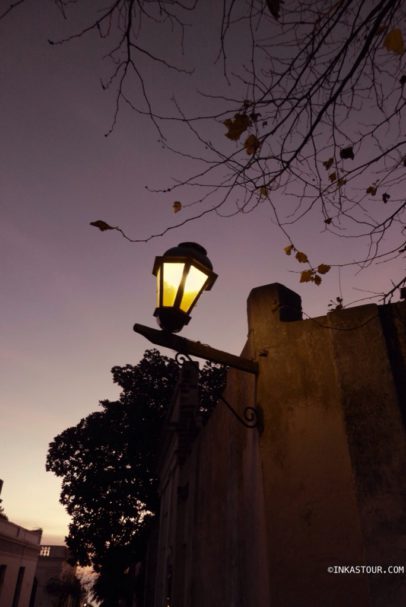
Where is `leaf to the left of the lamp`? Image resolution: width=406 pixels, height=607 pixels. leaf to the left of the lamp is located at coordinates (100, 226).